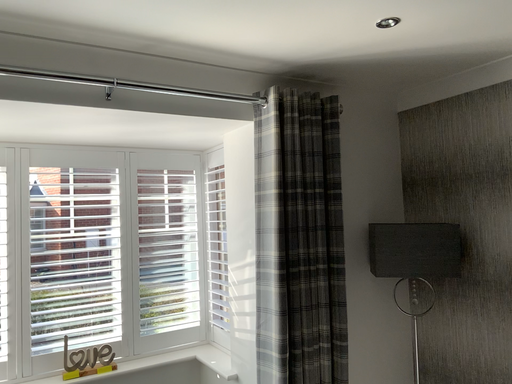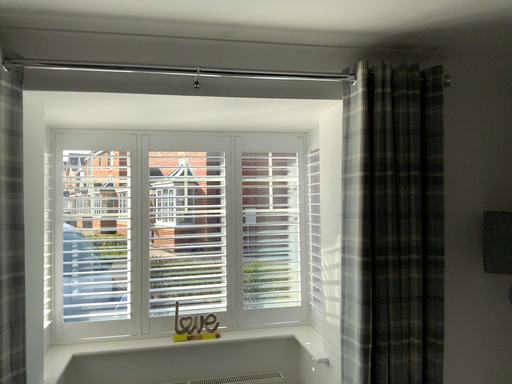
Question: How did the camera likely rotate when shooting the video?

Choices:
 (A) rotated left
 (B) rotated right

Answer: (A)